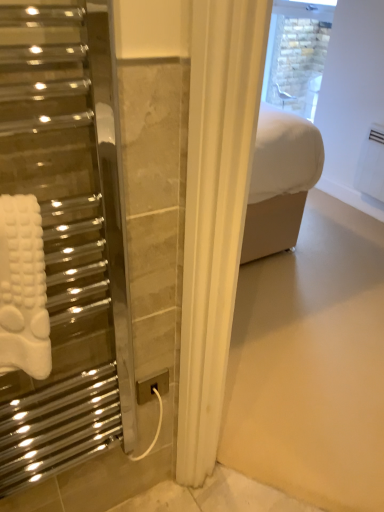
Find the location of a particular element. transparent glass door at upper right is located at coordinates (297, 54).

What do you see at coordinates (297, 54) in the screenshot? This screenshot has width=384, height=512. I see `transparent glass door at upper right` at bounding box center [297, 54].

The width and height of the screenshot is (384, 512). Identify the location of transparent glass door at upper right. (297, 54).